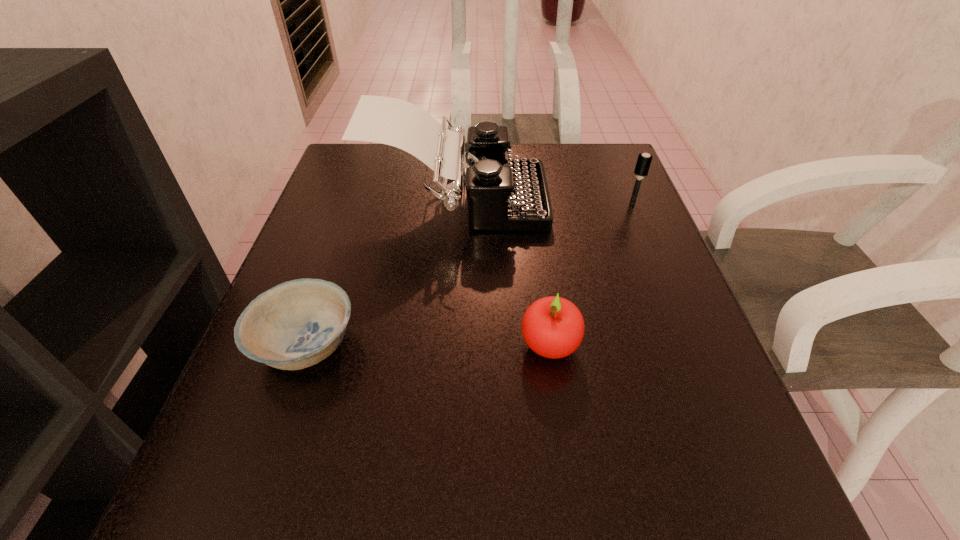
Identify the location of the tallest object. Image resolution: width=960 pixels, height=540 pixels. (503, 194).

Where is `the rightmost object`? This screenshot has height=540, width=960. the rightmost object is located at coordinates (644, 160).

Identify the location of apple. The width and height of the screenshot is (960, 540). tap(553, 327).

Find the location of `bowl`. bowl is located at coordinates (296, 324).

Identify the location of free space located 0.100m on the keys of the typewriter. (590, 202).

The height and width of the screenshot is (540, 960). I want to click on vacant space positioned 0.130m on the left of the hairbrush, so click(x=569, y=202).

The image size is (960, 540). I want to click on free region located on the back of the apple, so click(533, 223).

Locate an element on the screen. The image size is (960, 540). blank space located 0.230m on the back of the shortest object is located at coordinates (347, 225).

Where is `object at the far edge`? object at the far edge is located at coordinates (503, 194).

Find the location of a particular element. typewriter that is positioned at the left edge is located at coordinates (503, 194).